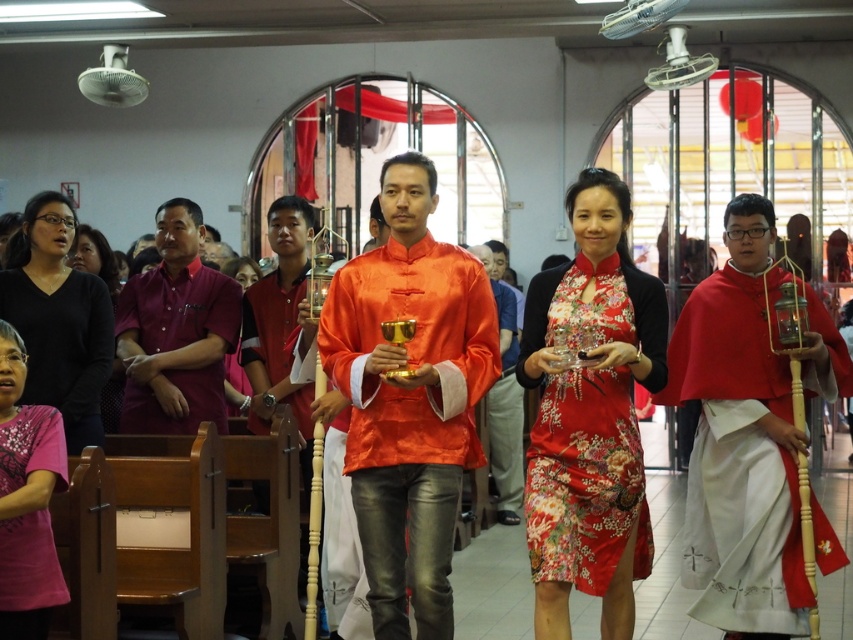
You are an event planner trying to arrange a photo shoot in the same location. You need to place a new decorative item exactly where the silky floral dress at center was positioned. What are the coordinates you should use for placement?

The coordinates for placing the decorative item should be at point (590, 416), as this is where the silky floral dress at center was positioned.

Based on the photo, you are standing in the center of the image. Which direction should you move to reach the black matte dress at lower left?

Since the black matte dress at lower left is located at point (57, 317), you should move to the lower left direction to reach it.

You are an event planner arranging a photo shoot in the described scene. You need to position a backdrop behind the two central figures wearing the silky floral dress at center and the matte pink blouse at center. Which figure should the backdrop be placed closer to to ensure both are in frame?

The backdrop should be placed closer to the silky floral dress at center because it is taller than the matte pink blouse at center, ensuring both figures are in frame by accounting for their height difference.